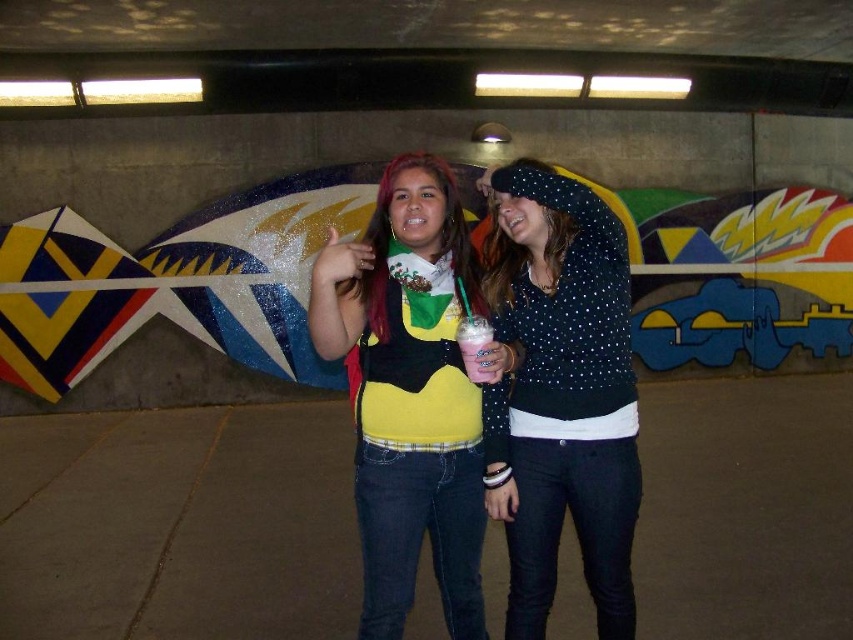
Question: Does polka dot sweater at center have a greater width compared to matte yellow sweater at center?

Choices:
 (A) no
 (B) yes

Answer: (A)

Question: Which point appears farthest from the camera in this image?

Choices:
 (A) (398, 493)
 (B) (491, 465)

Answer: (B)

Question: Which object is closer to the camera taking this photo?

Choices:
 (A) polka dot sweater at center
 (B) matte yellow sweater at center

Answer: (B)

Question: Is polka dot sweater at center wider than matte yellow sweater at center?

Choices:
 (A) no
 (B) yes

Answer: (A)

Question: From the image, what is the correct spatial relationship of polka dot sweater at center in relation to matte yellow sweater at center?

Choices:
 (A) below
 (B) above

Answer: (A)

Question: Among these points, which one is farthest from the camera?

Choices:
 (A) (408, 593)
 (B) (610, 540)

Answer: (B)